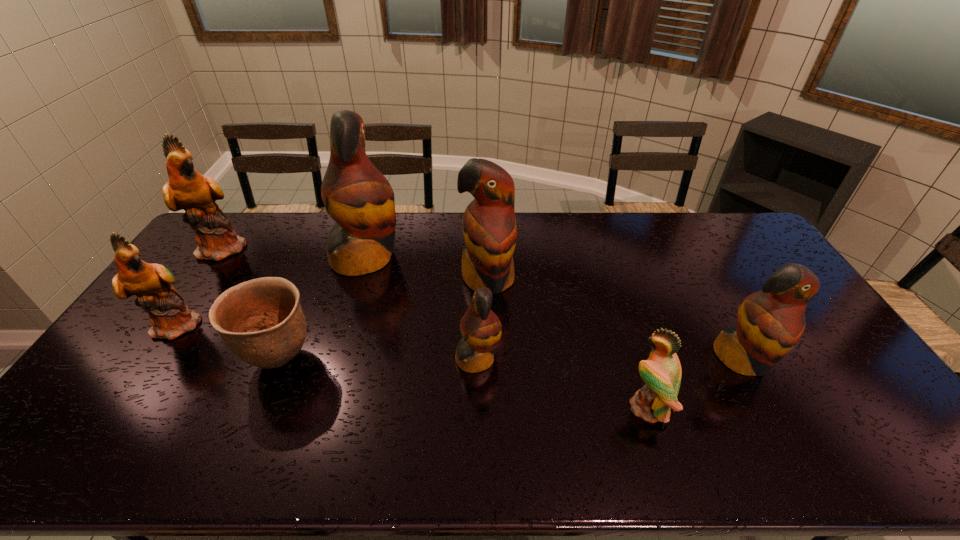
Find the location of a particular element. the fifth parrot from right to left is located at coordinates (357, 196).

Where is `the tallest parrot`? The width and height of the screenshot is (960, 540). the tallest parrot is located at coordinates (x=357, y=196).

I want to click on the farthest green parrot, so click(187, 189).

At what (x,y) coordinates should I click in order to perform the action: click on the third smallest red parrot. Please return your answer as a coordinate pair (x, y). Looking at the image, I should click on (489, 224).

The height and width of the screenshot is (540, 960). In order to click on the second farthest green parrot in this screenshot , I will do `click(170, 317)`.

This screenshot has width=960, height=540. In order to click on the rightmost object in this screenshot , I will do `click(770, 322)`.

Locate an element on the screen. Image resolution: width=960 pixels, height=540 pixels. the rightmost red parrot is located at coordinates (770, 322).

The width and height of the screenshot is (960, 540). In order to click on the nearest green parrot in this screenshot , I will do `click(661, 372)`.

Locate an element on the screen. The height and width of the screenshot is (540, 960). the nearest parrot is located at coordinates (661, 372).

I want to click on the smallest red parrot, so click(481, 329).